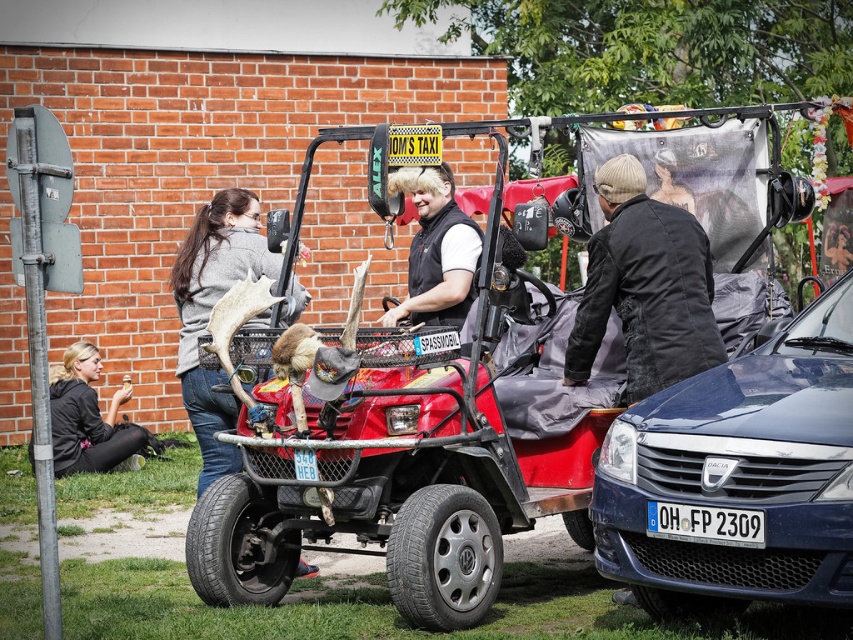
Question: In this image, where is distressed black jacket at center located relative to matte black jacket at upper center?

Choices:
 (A) below
 (B) above

Answer: (A)

Question: Which point is farther from the camera taking this photo?

Choices:
 (A) (453, 198)
 (B) (616, 433)
 (C) (709, 333)
 (D) (68, 352)

Answer: (D)

Question: Which of the following is the farthest from the observer?

Choices:
 (A) gray sweater at left
 (B) red matte jeep at center

Answer: (A)

Question: Which point is farther from the camera taking this photo?

Choices:
 (A) (740, 388)
 (B) (212, 468)

Answer: (B)

Question: Can you confirm if gray sweater at left is smaller than black leather vest at center?

Choices:
 (A) yes
 (B) no

Answer: (B)

Question: Does red matte jeep at center have a greater width compared to matte black jacket at upper center?

Choices:
 (A) no
 (B) yes

Answer: (B)